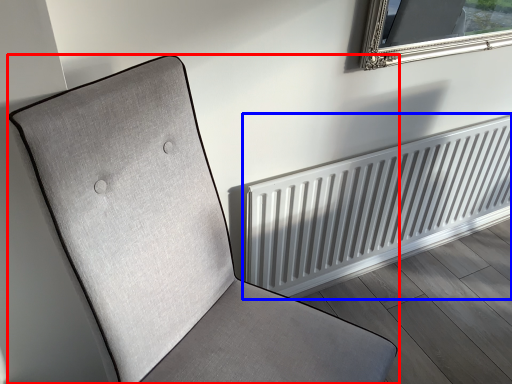
Question: Which object is further to the camera taking this photo, furniture (highlighted by a red box) or radiator (highlighted by a blue box)?

Choices:
 (A) furniture
 (B) radiator

Answer: (B)